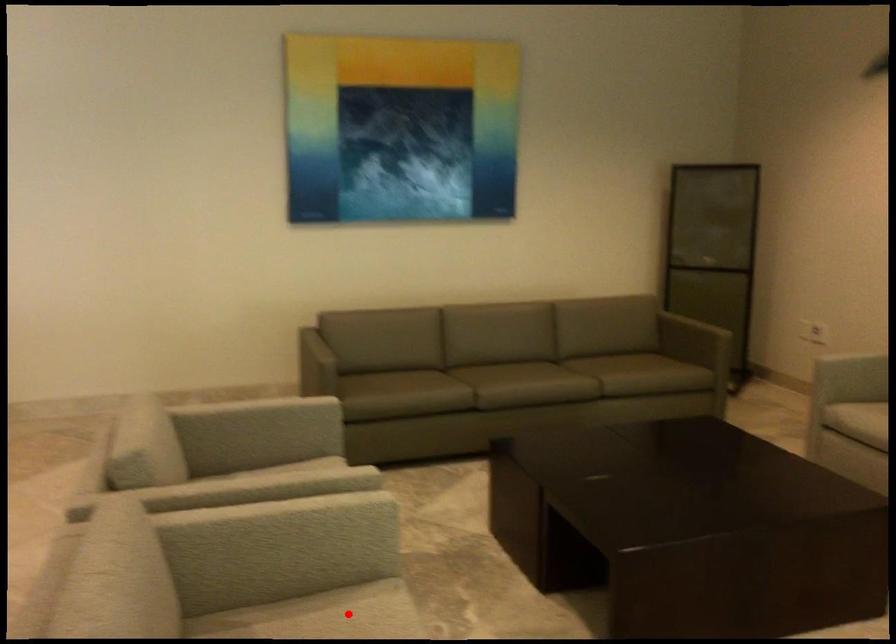
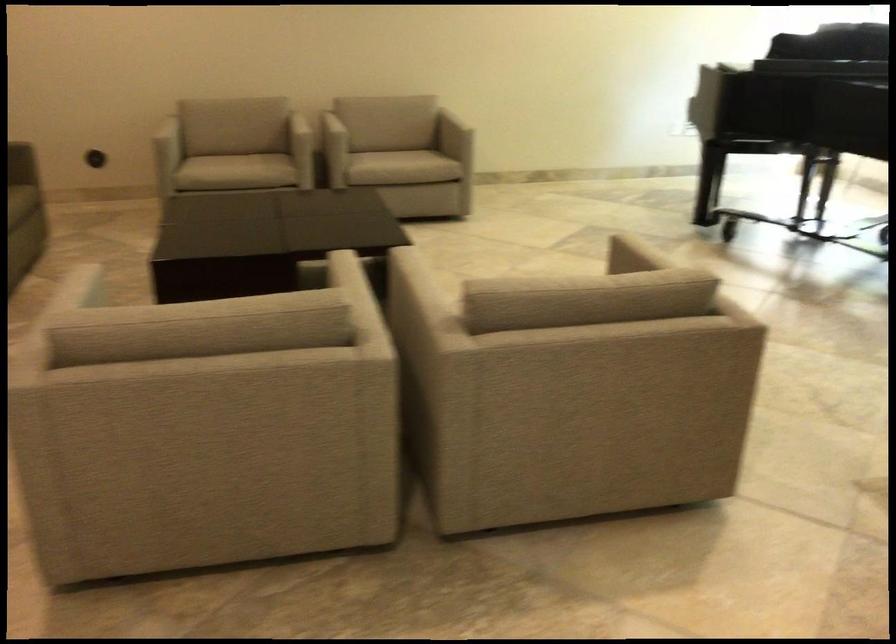
Question: I am providing you with two images of the same scene from different viewpoints. A red point is marked on the first image. At the location where the point appears in image 1, is it still visible in image 2?

Choices:
 (A) Yes
 (B) No

Answer: (B)